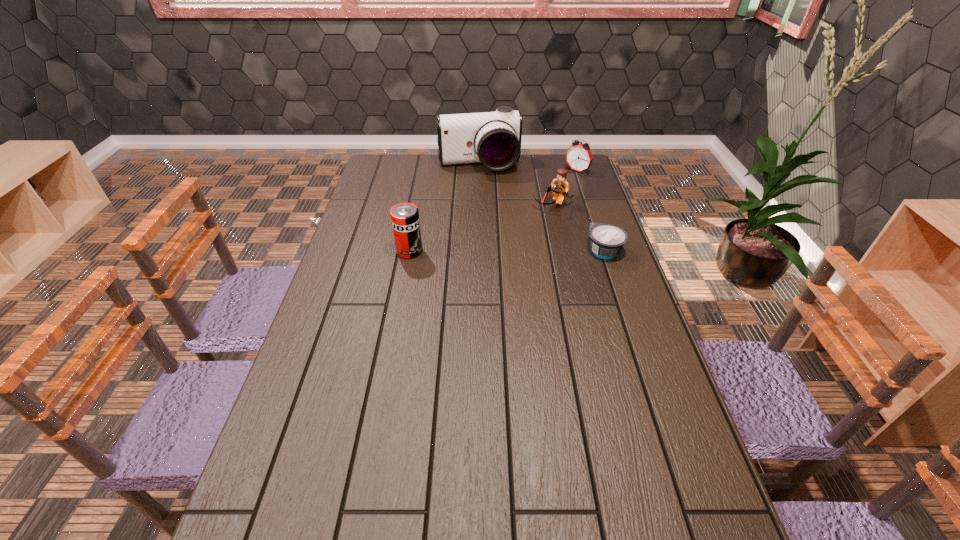
You are a GUI agent. You are given a task and a screenshot of the screen. Output one action in this format:
    pyautogui.click(x=<x>, y=<y>)
    Task: Click on the yogurt present at the right edge
    This screenshot has width=960, height=540.
    Given the screenshot: What is the action you would take?
    pyautogui.click(x=607, y=240)

I want to click on Lego situated at the right edge, so click(560, 186).

The width and height of the screenshot is (960, 540). Identify the location of alarm clock that is at the right edge. (578, 157).

Locate an element on the screen. object that is at the far right corner is located at coordinates (578, 157).

Locate an element on the screen. The image size is (960, 540). vacant space at the far edge of the desktop is located at coordinates (479, 176).

Locate an element on the screen. Image resolution: width=960 pixels, height=540 pixels. vacant space at the left edge of the desktop is located at coordinates (374, 206).

Find the location of `vacant space at the right edge`. vacant space at the right edge is located at coordinates (589, 261).

Locate an element on the screen. vacant area at the far left corner is located at coordinates coord(379,173).

This screenshot has width=960, height=540. What are the coordinates of `vacant region at the far right corner of the desktop` in the screenshot? It's located at (556, 159).

Where is `free space between the yogurt and the tallest object`? Image resolution: width=960 pixels, height=540 pixels. free space between the yogurt and the tallest object is located at coordinates (541, 208).